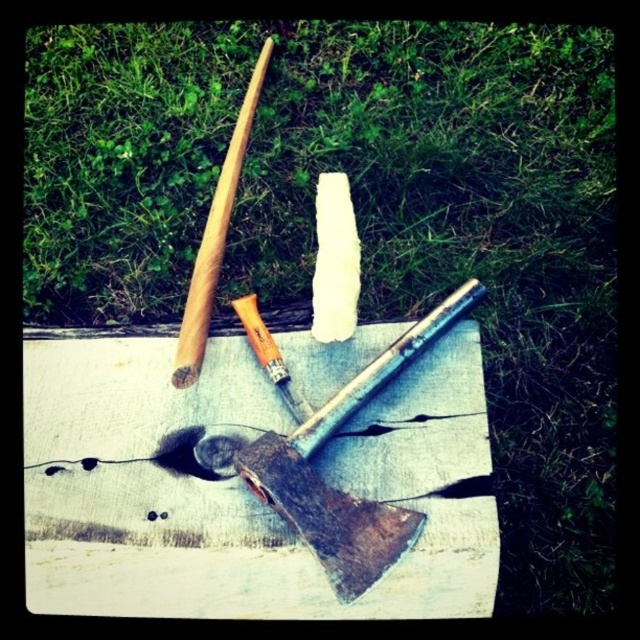
Question: Can you confirm if smooth wooden board at center is positioned to the right of wooden baseball bat at upper left?

Choices:
 (A) yes
 (B) no

Answer: (A)

Question: Can you confirm if smooth wooden board at center is smaller than wooden baseball bat at upper left?

Choices:
 (A) yes
 (B) no

Answer: (B)

Question: Is smooth wooden board at center further to the viewer compared to white plastic blade at center?

Choices:
 (A) yes
 (B) no

Answer: (B)

Question: Which object is closer to the camera taking this photo?

Choices:
 (A) white plastic blade at center
 (B) smooth wooden board at center
 (C) wooden baseball bat at upper left

Answer: (B)

Question: Which of the following is the farthest from the observer?

Choices:
 (A) wooden baseball bat at upper left
 (B) white plastic blade at center

Answer: (B)

Question: Which point is closer to the camera?

Choices:
 (A) (326, 294)
 (B) (202, 326)
 (C) (435, 545)

Answer: (C)